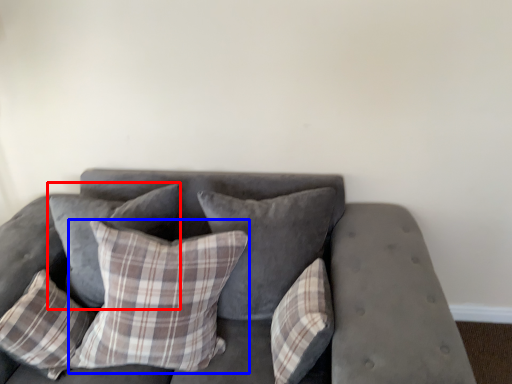
Question: Which object is closer to the camera taking this photo, pillow (highlighted by a red box) or pillow (highlighted by a blue box)?

Choices:
 (A) pillow
 (B) pillow

Answer: (B)